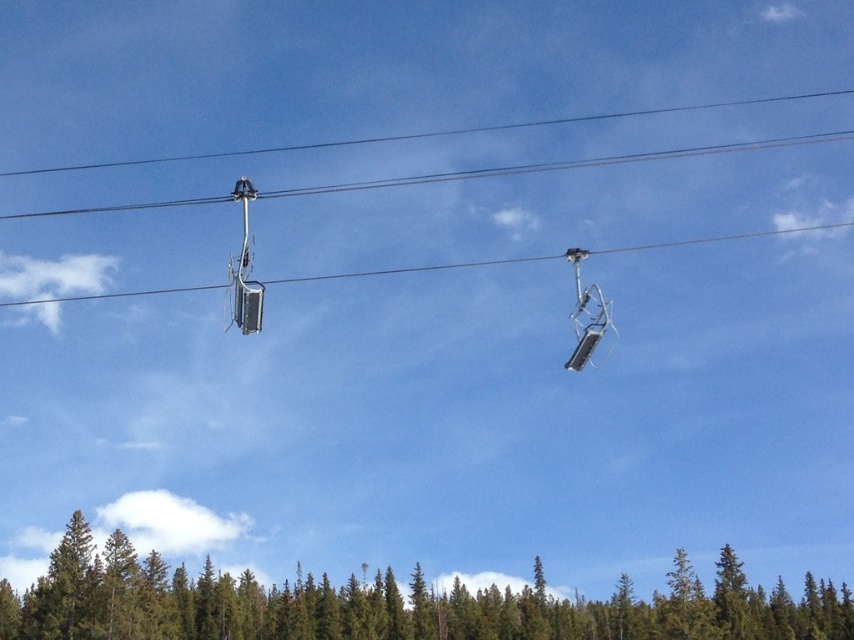
You are planning to install a new ski lift in the area. Given the current setup with the green textured pine forest at lower center and the metallic silver ski lift at upper center, which object occupies more horizontal space in the image?

The green textured pine forest at lower center occupies more horizontal space in the image because its width is larger than that of the metallic silver ski lift at upper center.

You are a photographer planning to take a picture of the green textured pine forest at lower center and the metallic gray ski lift at upper center. If you want to frame both objects in the same shot, which object should you position closer to the right side of the frame?

The green textured pine forest at lower center should be positioned closer to the right side of the frame because it is already on the right side of the metallic gray ski lift at upper center.